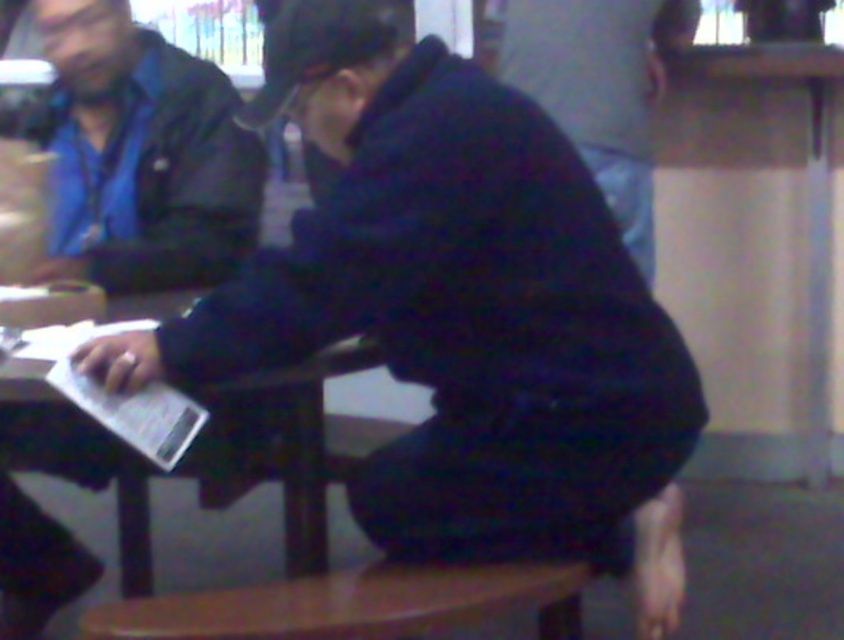
You are trying to place a small plant pot that requires 30 cm of space. You see the wooden stool at lower center and the dark blue fabric at center. Which object can accommodate the plant pot based on their widths?

The wooden stool at lower center might be wider than dark blue fabric at center, so the wooden stool at lower center can accommodate the plant pot if it is wider than 30 cm. However, since the exact width isn not provided, we can only suggest the stool as a potential option based on its comparative width.

Based on the photo, you are a person who wants to place a 1.5 meter long board on the wooden table at center and the dark blue fabric at center. Which object can accommodate the board without bending it?

The dark blue fabric at center can accommodate the board without bending it since it is longer than the wooden table at center.

You are a photographer standing at the camera position. You want to place a small tripod on the wooden stool at lower center to take a photo. The tripod requires 1 meter of space between the camera and the stool. Can you place it there?

The wooden stool at lower center and camera are 1.20 meters apart from each other, so yes, the tripod can be placed on the wooden stool at lower center since the distance between them is sufficient.